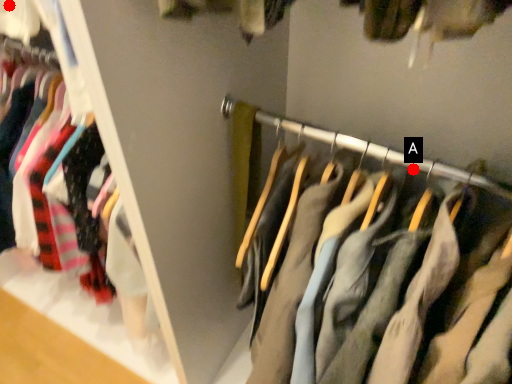
Question: Two points are circled on the image, labeled by A and B beside each circle. Which point appears farthest from the camera in this image?

Choices:
 (A) A is further
 (B) B is further

Answer: (A)